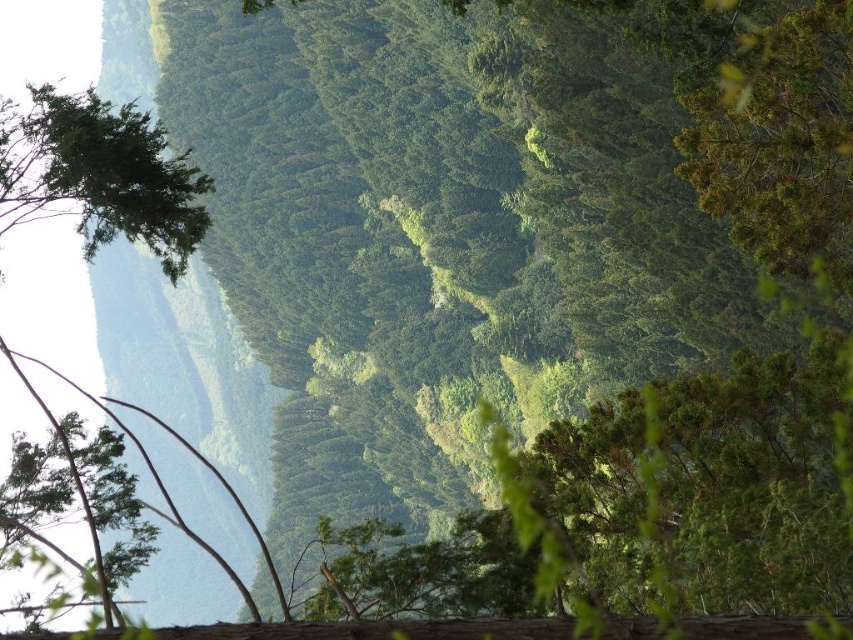
Question: Is green leafy tree at upper left to the right of green leafy tree at left from the viewer's perspective?

Choices:
 (A) no
 (B) yes

Answer: (A)

Question: Which point is closer to the camera?

Choices:
 (A) (109, 104)
 (B) (3, 552)

Answer: (B)

Question: Does green leafy tree at upper left have a lesser width compared to green leafy tree at left?

Choices:
 (A) yes
 (B) no

Answer: (B)

Question: Considering the relative positions of green leafy tree at upper left and green leafy tree at left in the image provided, where is green leafy tree at upper left located with respect to green leafy tree at left?

Choices:
 (A) below
 (B) above

Answer: (B)

Question: Which object is farther from the camera taking this photo?

Choices:
 (A) green leafy tree at upper left
 (B) green leafy tree at left

Answer: (A)

Question: Among these objects, which one is nearest to the camera?

Choices:
 (A) green leafy tree at left
 (B) green leafy tree at upper left

Answer: (A)